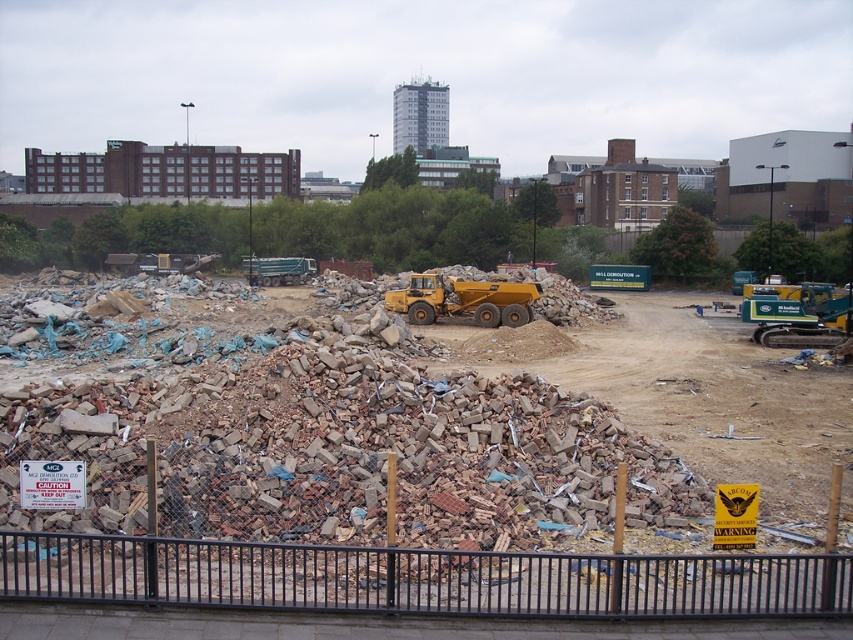
You are a safety inspector standing at the entrance of the construction site. You notice the black metal fence at lower center and the yellow rubber dump truck at center. Which object is nearer to you?

The black metal fence at lower center is closer to the viewer than the yellow rubber dump truck at center, so the black metal fence at lower center is nearer to you.

You are standing at the point marked as point (418, 579) in the image. What object is exactly at that location?

The black metal fence at lower center is exactly at point (418, 579).